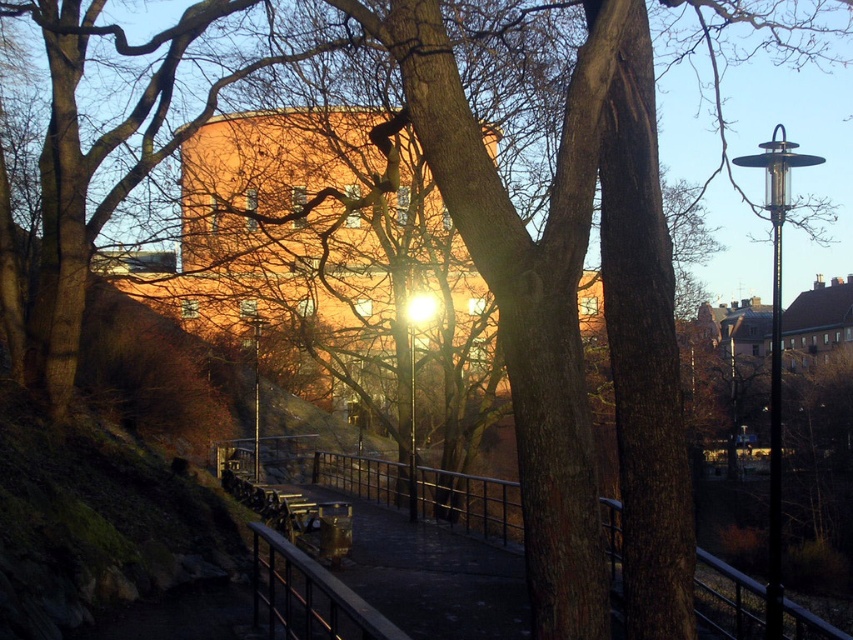
Question: Which of the following is the farthest from the observer?

Choices:
 (A) (254, 349)
 (B) (432, 301)
 (C) (775, 513)
 (D) (404, 486)

Answer: (A)

Question: Among these points, which one is farthest from the camera?

Choices:
 (A) (827, 628)
 (B) (769, 493)
 (C) (242, 305)

Answer: (C)

Question: Is metallic gray rail at center below metallic pole at center?

Choices:
 (A) no
 (B) yes

Answer: (B)

Question: Where is metallic gray rail at center located in relation to metallic glass lamp post at center in the image?

Choices:
 (A) left
 (B) right

Answer: (B)

Question: Among these objects, which one is farthest from the camera?

Choices:
 (A) black metal lamp post at right
 (B) metallic pole at center
 (C) metallic glass lamp post at center
 (D) metallic gray rail at center

Answer: (B)

Question: Can you confirm if metallic gray rail at center is positioned below metallic glass lamp post at center?

Choices:
 (A) yes
 (B) no

Answer: (A)